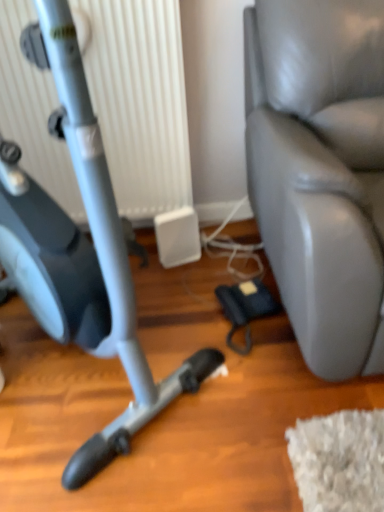
At what (x,y) coordinates should I click in order to perform the action: click on free point to the right of matte gray stationary bicycle at left. Please return your answer as a coordinate pair (x, y). The height and width of the screenshot is (512, 384). Looking at the image, I should click on (249, 370).